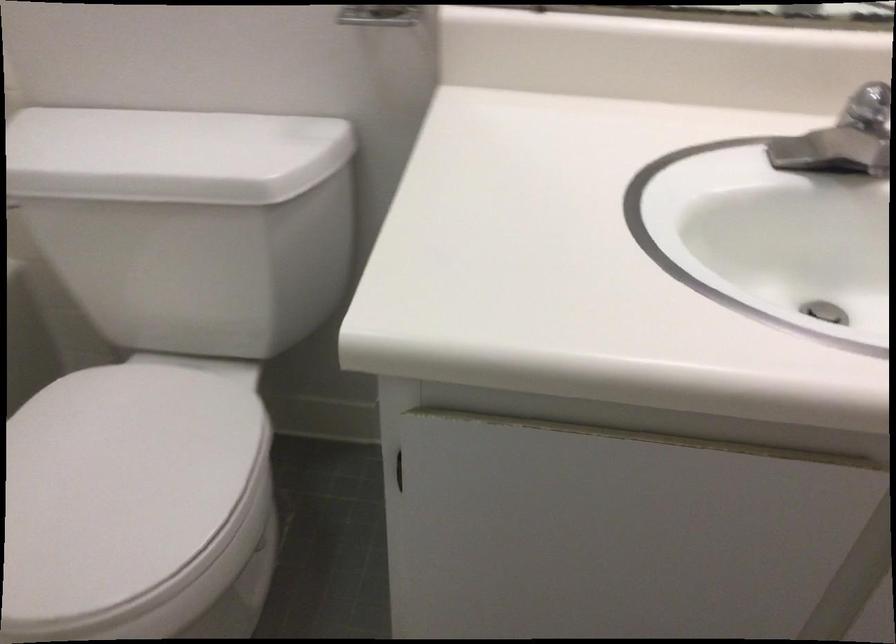
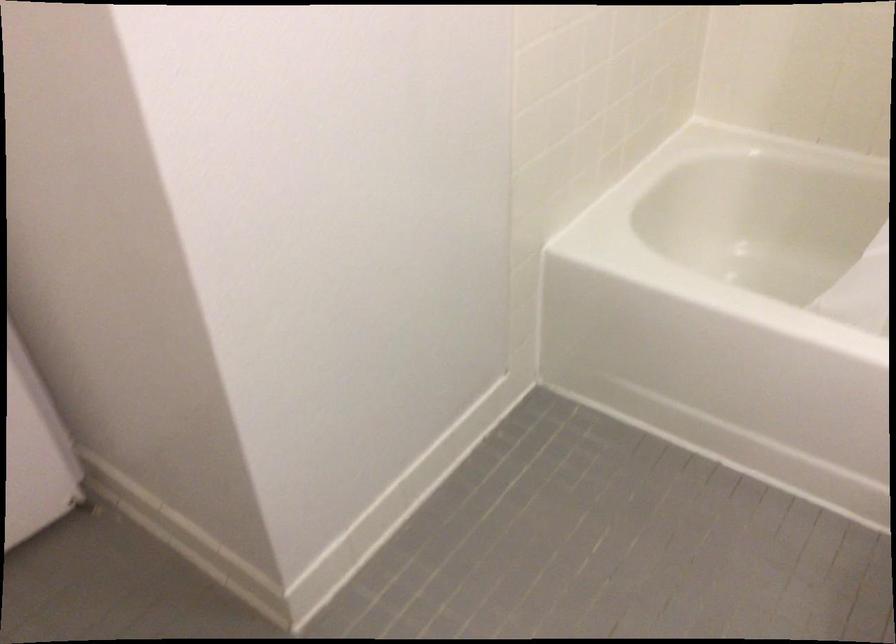
Looking at this image, the first image is from the beginning of the video and the second image is from the end. How did the camera likely rotate when shooting the video?

The camera rotated toward left-down.